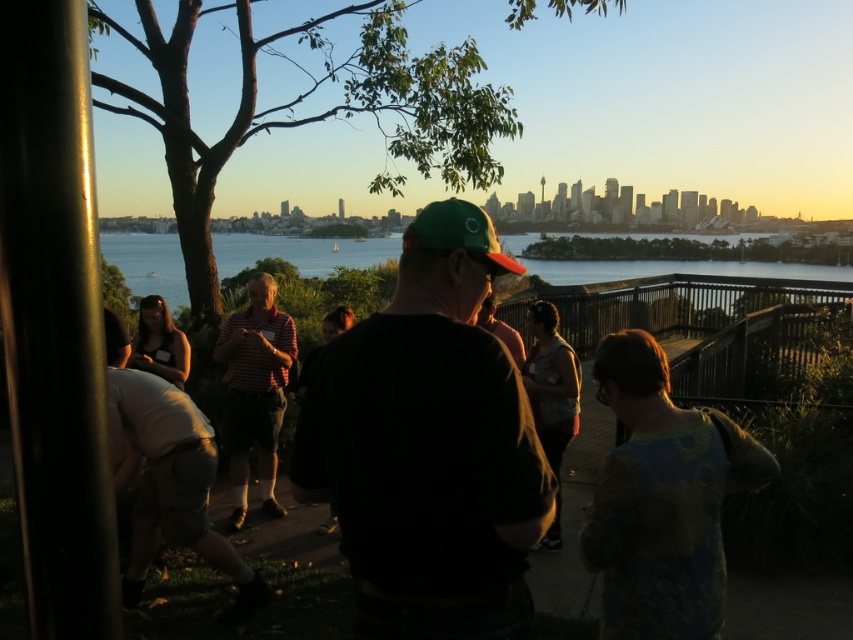
Question: Which point appears farthest from the camera in this image?

Choices:
 (A) 506,269
 (B) 178,275
 (C) 461,326
 (D) 532,316

Answer: (B)

Question: Which point is farther to the camera?

Choices:
 (A) (457, 218)
 (B) (376, 355)

Answer: (A)

Question: Can you confirm if light brown shorts at center is wider than blue water at center?

Choices:
 (A) yes
 (B) no

Answer: (B)

Question: Does blue water at center have a smaller size compared to striped cotton shirt at center?

Choices:
 (A) yes
 (B) no

Answer: (B)

Question: Observing the image, what is the correct spatial positioning of striped cotton shirt at center in reference to denim jacket at center?

Choices:
 (A) left
 (B) right

Answer: (A)

Question: Which is farther from the green fabric baseball cap at center?

Choices:
 (A) light brown shorts at center
 (B) striped cotton shirt at center
 (C) blue water at center
 (D) denim jacket at center

Answer: (C)